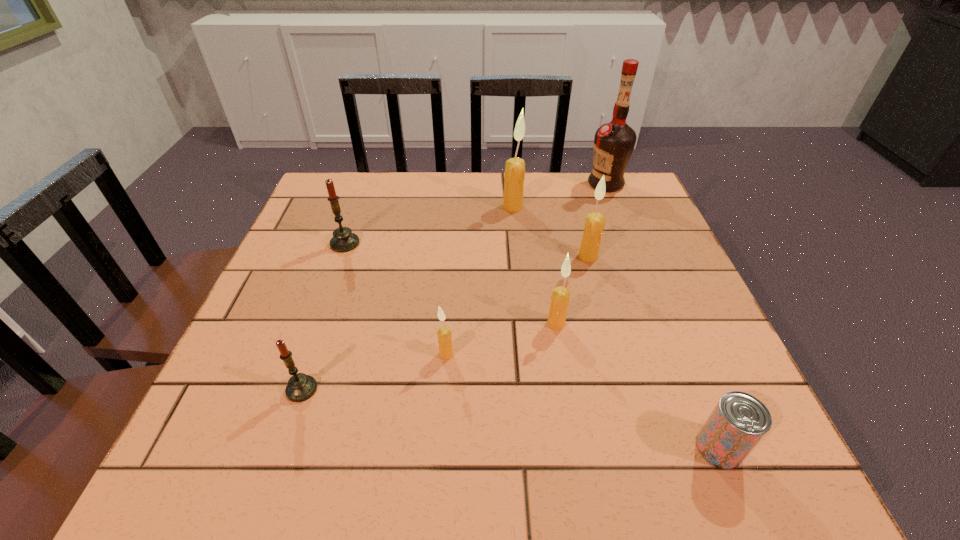
Locate an element on the screen. The height and width of the screenshot is (540, 960). object located at the far right corner is located at coordinates (614, 142).

Find the location of `object that is at the near right corner`. object that is at the near right corner is located at coordinates (739, 421).

The height and width of the screenshot is (540, 960). Find the location of `vacant area at the far edge of the desktop`. vacant area at the far edge of the desktop is located at coordinates (421, 211).

I want to click on free space at the near edge of the desktop, so click(x=551, y=464).

The image size is (960, 540). I want to click on vacant space at the left edge of the desktop, so click(300, 406).

Identify the location of vacant space at the right edge of the desktop. The width and height of the screenshot is (960, 540). (694, 289).

This screenshot has height=540, width=960. I want to click on vacant space at the far left corner of the desktop, so click(347, 206).

In the image, there is a desktop. Where is `free space at the far right corner`? free space at the far right corner is located at coordinates (627, 218).

Find the location of a particular element. Image resolution: width=960 pixels, height=540 pixels. free space between the tallest object and the beer can is located at coordinates (662, 316).

Identify the location of free space between the bigger red candle and the red beer can. (532, 346).